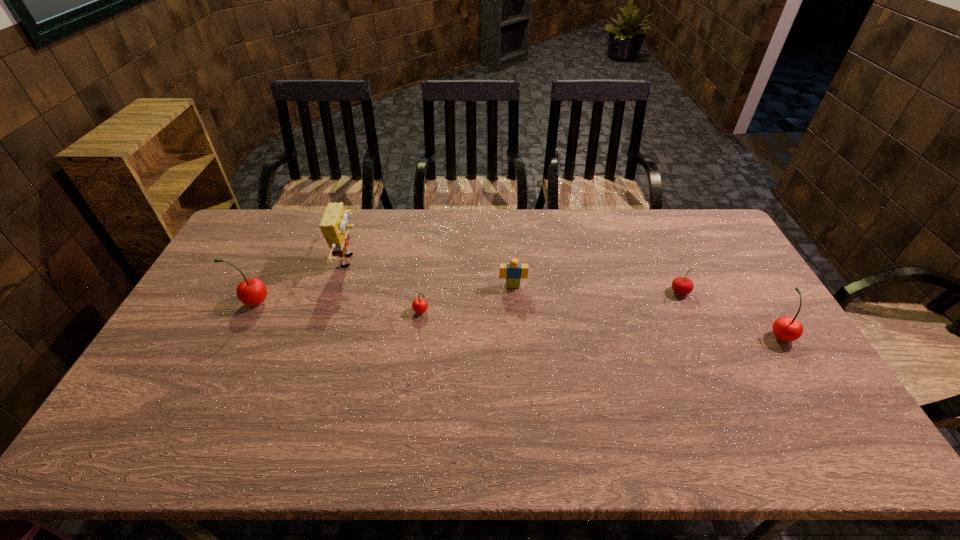
You are a GUI agent. You are given a task and a screenshot of the screen. Output one action in this format:
    pyautogui.click(x=<x>, y=<y>)
    Task: Click on the free space at the far left corner of the desktop
    This screenshot has width=960, height=540.
    Given the screenshot: What is the action you would take?
    pyautogui.click(x=291, y=209)

Find the location of a particular element. The width and height of the screenshot is (960, 540). free spot at the near left corner of the desktop is located at coordinates (179, 386).

Find the location of a particular element. free point at the far right corner is located at coordinates (673, 211).

Find the location of a particular element. The width and height of the screenshot is (960, 540). free spot at the near right corner of the desktop is located at coordinates (831, 415).

Locate an element on the screen. The width and height of the screenshot is (960, 540). free spot between the fifth object from left to right and the fourth object from right to left is located at coordinates (550, 302).

The image size is (960, 540). What are the coordinates of `blank region between the fifth object from left to right and the Lego` in the screenshot? It's located at (596, 289).

Identify the location of free point between the leftmost cherry and the fifth object from right to left. The height and width of the screenshot is (540, 960). 301,281.

This screenshot has height=540, width=960. I want to click on free space between the second cherry from left to right and the third cherry from left to right, so click(x=550, y=302).

Where is `empty location between the Lego and the third cherry from right to left`? empty location between the Lego and the third cherry from right to left is located at coordinates click(x=467, y=299).

Locate an element on the screen. The height and width of the screenshot is (540, 960). free area in between the rightmost cherry and the fifth object from left to right is located at coordinates (730, 313).